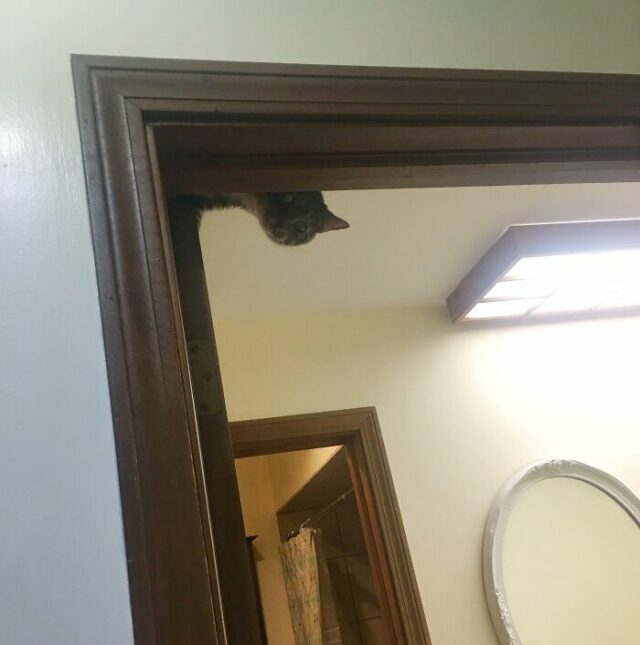
Identify the location of mirror. This screenshot has height=645, width=640. (585, 577).